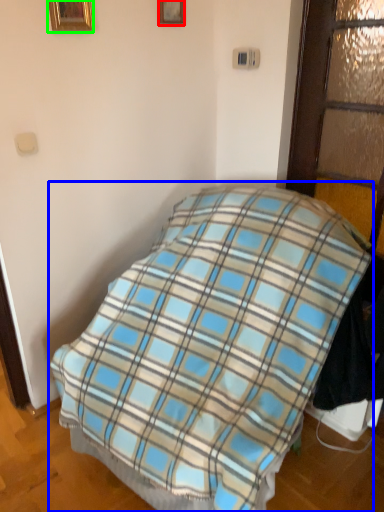
Question: Based on their relative distances, which object is farther from picture frame (highlighted by a red box)? Choose from bed (highlighted by a blue box) and picture frame (highlighted by a green box).

Choices:
 (A) bed
 (B) picture frame

Answer: (A)